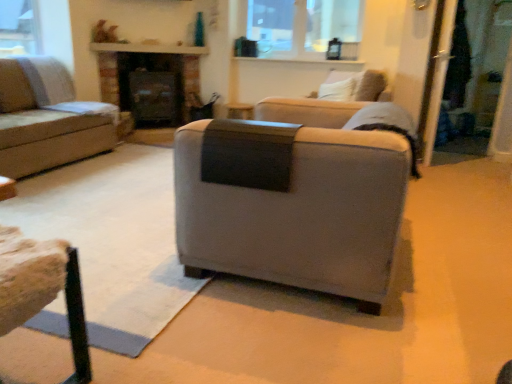
Question: From a real-world perspective, does light beige fabric couch at left, which appears as the first studio couch when viewed from the top, stand above clear glass window at upper center?

Choices:
 (A) yes
 (B) no

Answer: (B)

Question: Is light beige fabric couch at left, which appears as the first studio couch when viewed from the top, looking in the opposite direction of clear glass window at upper center?

Choices:
 (A) yes
 (B) no

Answer: (B)

Question: From the image's perspective, is light beige fabric couch at left, the 2th studio couch when ordered from front to back, under clear glass window at upper center?

Choices:
 (A) no
 (B) yes

Answer: (B)

Question: Are light beige fabric couch at left, which is counted as the first studio couch, starting from the left, and clear glass window at upper center located far from each other?

Choices:
 (A) no
 (B) yes

Answer: (B)

Question: Is light beige fabric couch at left, the 2th studio couch when ordered from bottom to top, in front of clear glass window at upper center?

Choices:
 (A) yes
 (B) no

Answer: (A)

Question: Considering the relative sizes of light beige fabric couch at left, which is counted as the first studio couch, starting from the left, and clear glass window at upper center in the image provided, is light beige fabric couch at left, which is counted as the first studio couch, starting from the left, bigger than clear glass window at upper center?

Choices:
 (A) yes
 (B) no

Answer: (A)

Question: Is suede gray armchair at center, acting as the second studio couch starting from the left, completely or partially inside wooden textured stool at lower left?

Choices:
 (A) no
 (B) yes

Answer: (A)

Question: Can you confirm if wooden textured stool at lower left is shorter than suede gray armchair at center, acting as the second studio couch starting from the left?

Choices:
 (A) yes
 (B) no

Answer: (A)

Question: From a real-world perspective, does wooden textured stool at lower left sit lower than suede gray armchair at center, positioned as the first studio couch in front-to-back order?

Choices:
 (A) no
 (B) yes

Answer: (B)

Question: Can you confirm if wooden textured stool at lower left is positioned to the left of suede gray armchair at center, which appears as the second studio couch when viewed from the back?

Choices:
 (A) yes
 (B) no

Answer: (A)

Question: Can you confirm if wooden textured stool at lower left is smaller than suede gray armchair at center, acting as the second studio couch starting from the left?

Choices:
 (A) no
 (B) yes

Answer: (B)

Question: Is wooden textured stool at lower left closer to the viewer compared to suede gray armchair at center, the first studio couch ordered from the bottom?

Choices:
 (A) yes
 (B) no

Answer: (A)

Question: Is light gray fabric armchair at upper right smaller than wooden textured stool at lower left?

Choices:
 (A) yes
 (B) no

Answer: (B)